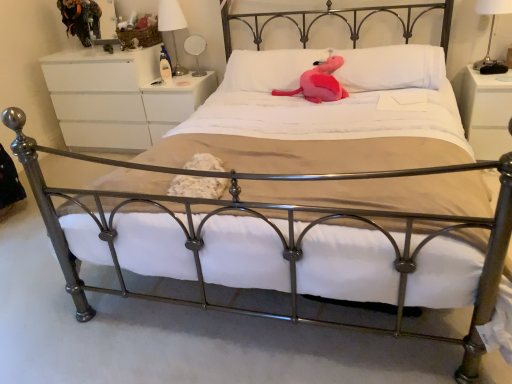
Question: Should I look upward or downward to see pink plush at center, the 2th pillow viewed from the right?

Choices:
 (A) up
 (B) down

Answer: (A)

Question: Does white fabric lampshade at upper right, positioned as the 1th bedside lamp in front-to-back order, come in front of pink plush at center, the 2th pillow viewed from the right?

Choices:
 (A) yes
 (B) no

Answer: (A)

Question: Is white fabric lampshade at upper right, arranged as the second bedside lamp when viewed from the left, not close to pink plush at center, the first pillow from the left?

Choices:
 (A) no
 (B) yes

Answer: (B)

Question: Is pink plush at center, the first pillow from the left, inside white fabric lampshade at upper right, arranged as the 1th bedside lamp when viewed from the right?

Choices:
 (A) yes
 (B) no

Answer: (B)

Question: Considering the relative sizes of white fabric lampshade at upper right, arranged as the second bedside lamp when viewed from the left, and pink plush at center, the first pillow from the left, in the image provided, is white fabric lampshade at upper right, arranged as the second bedside lamp when viewed from the left, shorter than pink plush at center, the first pillow from the left,?

Choices:
 (A) yes
 (B) no

Answer: (B)

Question: From the image's perspective, does white fabric lampshade at upper right, positioned as the 1th bedside lamp in front-to-back order, appear lower than pink plush at center, the 2th pillow viewed from the right?

Choices:
 (A) no
 (B) yes

Answer: (A)

Question: Is white fabric lampshade at upper right, acting as the 2th bedside lamp starting from the back, further to the viewer compared to pink plush at center, the first pillow from the left?

Choices:
 (A) no
 (B) yes

Answer: (A)

Question: Is pink plush at center, the 1th pillow from the right, inside white glossy lampshade at upper center, arranged as the first bedside lamp when viewed from the left?

Choices:
 (A) yes
 (B) no

Answer: (B)

Question: Is white glossy lampshade at upper center, arranged as the first bedside lamp when viewed from the left, smaller than pink plush at center, the 1th pillow from the right?

Choices:
 (A) yes
 (B) no

Answer: (A)

Question: Is white glossy lampshade at upper center, placed as the 2th bedside lamp when sorted from front to back, to the right of pink plush at center, placed as the second pillow when sorted from left to right, from the viewer's perspective?

Choices:
 (A) no
 (B) yes

Answer: (A)

Question: From the image's perspective, is white glossy lampshade at upper center, acting as the 1th bedside lamp starting from the back, located above pink plush at center, placed as the second pillow when sorted from left to right?

Choices:
 (A) yes
 (B) no

Answer: (A)

Question: Can you confirm if white glossy lampshade at upper center, acting as the 1th bedside lamp starting from the back, is positioned to the left of pink plush at center, the 1th pillow from the right?

Choices:
 (A) yes
 (B) no

Answer: (A)

Question: Is white glossy lampshade at upper center, arranged as the first bedside lamp when viewed from the left, located outside pink plush at center, placed as the second pillow when sorted from left to right?

Choices:
 (A) yes
 (B) no

Answer: (A)

Question: Is white matte dresser at upper left, positioned as the 3th nightstand in right-to-left order, positioned with its back to white glossy lampshade at upper center, placed as the 2th bedside lamp when sorted from front to back?

Choices:
 (A) yes
 (B) no

Answer: (B)